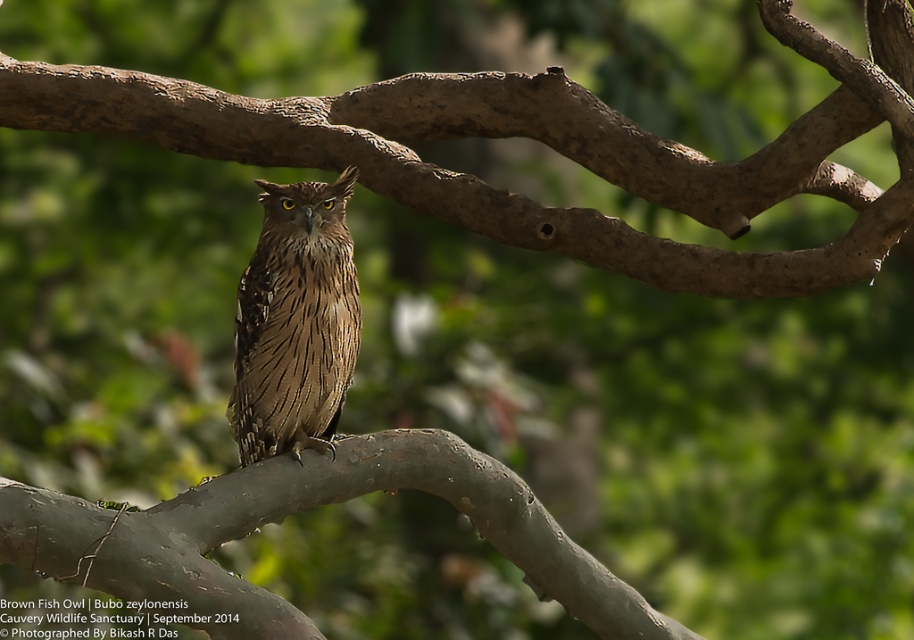
Question: Which of the following is the farthest from the observer?

Choices:
 (A) brown feathered owl at center
 (B) brown wood tree branch at center
 (C) brown matte branch at center

Answer: (A)

Question: Considering the relative positions of brown matte branch at center and brown feathered owl at center in the image provided, where is brown matte branch at center located with respect to brown feathered owl at center?

Choices:
 (A) right
 (B) left

Answer: (A)

Question: Can you confirm if brown wood tree branch at center is positioned above brown matte branch at center?

Choices:
 (A) no
 (B) yes

Answer: (B)

Question: Does brown matte branch at center appear under brown feathered owl at center?

Choices:
 (A) no
 (B) yes

Answer: (B)

Question: Estimate the real-world distances between objects in this image. Which object is closer to the brown wood tree branch at center?

Choices:
 (A) brown matte branch at center
 (B) brown feathered owl at center

Answer: (B)

Question: Which point appears farthest from the camera in this image?

Choices:
 (A) pyautogui.click(x=270, y=250)
 (B) pyautogui.click(x=460, y=461)
 (C) pyautogui.click(x=888, y=8)

Answer: (A)